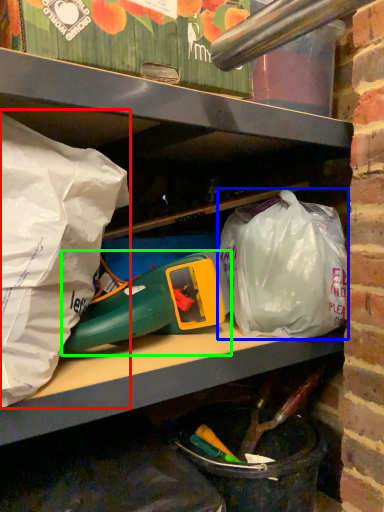
Question: Considering the real-world distances, which object is farthest from plastic bag (highlighted by a red box)? plastic bag (highlighted by a blue box) or toy (highlighted by a green box)?

Choices:
 (A) plastic bag
 (B) toy

Answer: (A)